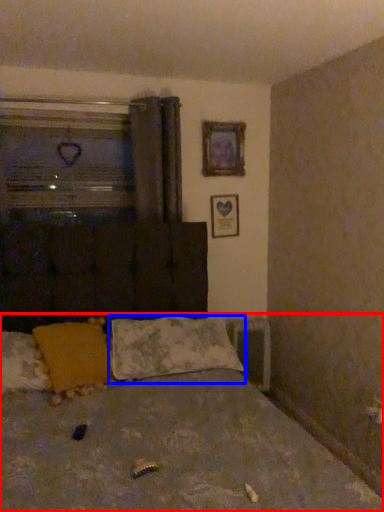
Question: Which point is closer to the camera, bed (highlighted by a red box) or pillow (highlighted by a blue box)?

Choices:
 (A) bed
 (B) pillow

Answer: (A)